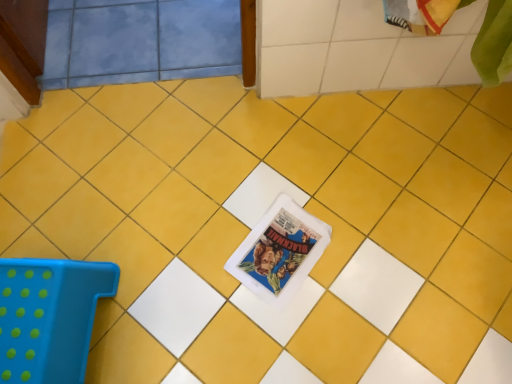
The image size is (512, 384). What do you see at coordinates (49, 317) in the screenshot?
I see `blue plastic stool at lower left` at bounding box center [49, 317].

I want to click on blue plastic stool at lower left, so click(49, 317).

What is the approximate width of blue plastic stool at lower left?

It is 13.83 inches.

Describe the element at coordinates (279, 251) in the screenshot. This screenshot has width=512, height=384. I see `matte plastic comic book at center` at that location.

Where is `matte plastic comic book at center`? This screenshot has width=512, height=384. matte plastic comic book at center is located at coordinates [279, 251].

Identify the location of blue plastic stool at lower left. This screenshot has height=384, width=512. (49, 317).

Is matte plastic comic book at center at the right side of blue plastic stool at lower left?

Yes.

Is matte plastic comic book at center closer to the viewer compared to blue plastic stool at lower left?

No, it is not.

Does point (290, 203) come farther from viewer compared to point (39, 317)?

Yes.

In the scene shown: From the image's perspective, is matte plastic comic book at center positioned above or below blue plastic stool at lower left?

Based on their image positions, matte plastic comic book at center is located above blue plastic stool at lower left.

From a real-world perspective, relative to blue plastic stool at lower left, is matte plastic comic book at center vertically above or below?

matte plastic comic book at center is below blue plastic stool at lower left.

Does matte plastic comic book at center have a lesser width compared to blue plastic stool at lower left?

Yes.

Looking at this image, between matte plastic comic book at center and blue plastic stool at lower left, which one has less height?

matte plastic comic book at center is shorter.

Who is smaller, matte plastic comic book at center or blue plastic stool at lower left?

Smaller between the two is matte plastic comic book at center.

Is matte plastic comic book at center positioned beyond the bounds of blue plastic stool at lower left?

Indeed, matte plastic comic book at center is completely outside blue plastic stool at lower left.

Is matte plastic comic book at center directly adjacent to blue plastic stool at lower left?

matte plastic comic book at center and blue plastic stool at lower left are not in contact.

Is matte plastic comic book at center oriented towards blue plastic stool at lower left?

No, matte plastic comic book at center does not turn towards blue plastic stool at lower left.

Looking at this image, how different are the orientations of matte plastic comic book at center and blue plastic stool at lower left in degrees?

48 degrees.

How far apart are matte plastic comic book at center and blue plastic stool at lower left?

matte plastic comic book at center and blue plastic stool at lower left are 18.33 inches apart from each other.

You are a GUI agent. You are given a task and a screenshot of the screen. Output one action in this format:
    pyautogui.click(x=<x>, y=<y>)
    Task: Click on the comic book below the blue plastic stool at lower left (from a real-world perspective)
    The width and height of the screenshot is (512, 384).
    Given the screenshot: What is the action you would take?
    pyautogui.click(x=279, y=251)

Is blue plastic stool at lower left to the left of matte plastic comic book at center from the viewer's perspective?

Indeed, blue plastic stool at lower left is positioned on the left side of matte plastic comic book at center.

From the picture: Considering the positions of objects blue plastic stool at lower left and matte plastic comic book at center in the image provided, who is behind, blue plastic stool at lower left or matte plastic comic book at center?

matte plastic comic book at center is further from the camera.

Is point (73, 377) positioned after point (286, 249)?

No, it is in front of (286, 249).

From the image's perspective, which one is positioned lower, blue plastic stool at lower left or matte plastic comic book at center?

blue plastic stool at lower left appears lower in the image.

From a real-world perspective, which object rests below the other?

From a 3D spatial view, matte plastic comic book at center is below.

Which object is thinner, blue plastic stool at lower left or matte plastic comic book at center?

With smaller width is matte plastic comic book at center.

Between blue plastic stool at lower left and matte plastic comic book at center, which one has less height?

Standing shorter between the two is matte plastic comic book at center.

Which of these two, blue plastic stool at lower left or matte plastic comic book at center, is bigger?

With larger size is blue plastic stool at lower left.

Is blue plastic stool at lower left not within matte plastic comic book at center?

Yes, blue plastic stool at lower left is located beyond the bounds of matte plastic comic book at center.

Is blue plastic stool at lower left with matte plastic comic book at center?

No, blue plastic stool at lower left is not beside matte plastic comic book at center.

Is blue plastic stool at lower left looking in the opposite direction of matte plastic comic book at center?

No, blue plastic stool at lower left's orientation is not away from matte plastic comic book at center.

How different are the orientations of blue plastic stool at lower left and matte plastic comic book at center in degrees?

blue plastic stool at lower left and matte plastic comic book at center are facing 48 degrees away from each other.

This screenshot has width=512, height=384. In order to click on furniture on the left of matte plastic comic book at center in this screenshot , I will do `click(49, 317)`.

Locate an element on the screen. comic book located above the blue plastic stool at lower left (from the image's perspective) is located at coordinates (279, 251).

You are a GUI agent. You are given a task and a screenshot of the screen. Output one action in this format:
    pyautogui.click(x=<x>, y=<y>)
    Task: Click on the comic book behind the blue plastic stool at lower left
    The width and height of the screenshot is (512, 384).
    Given the screenshot: What is the action you would take?
    pyautogui.click(x=279, y=251)